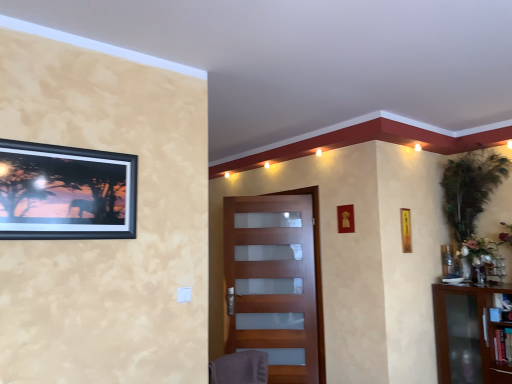
The image size is (512, 384). Describe the element at coordinates (67, 192) in the screenshot. I see `black matte picture frame at upper left, which ranks as the first picture frame in front-to-back order` at that location.

Where is `matte wood door at center`? This screenshot has height=384, width=512. matte wood door at center is located at coordinates (276, 282).

Does black matte picture frame at upper left, which ranks as the first picture frame in front-to-back order, appear on the right side of matte wood door at center?

In fact, black matte picture frame at upper left, which ranks as the first picture frame in front-to-back order, is to the left of matte wood door at center.

Can you tell me how much black matte picture frame at upper left, which ranks as the first picture frame in front-to-back order, and matte wood door at center differ in facing direction?

The angular difference between black matte picture frame at upper left, which ranks as the first picture frame in front-to-back order, and matte wood door at center is 26.3 degrees.

Does black matte picture frame at upper left, acting as the 2th picture frame starting from the back, lie in front of matte wood door at center?

Yes, it is in front of matte wood door at center.

You are a GUI agent. You are given a task and a screenshot of the screen. Output one action in this format:
    pyautogui.click(x=<x>, y=<y>)
    Task: Click on the door that appears below the black matte picture frame at upper left, which ranks as the first picture frame in front-to-back order (from a real-world perspective)
    This screenshot has height=384, width=512.
    Given the screenshot: What is the action you would take?
    pyautogui.click(x=276, y=282)

Is yellow paper at upper right, the second picture frame when ordered from top to bottom, spatially inside gray fabric swivel chair at lower center, or outside of it?

yellow paper at upper right, the second picture frame when ordered from top to bottom, is located beyond the bounds of gray fabric swivel chair at lower center.

In the scene shown: In terms of size, does yellow paper at upper right, the first picture frame viewed from the right, appear bigger or smaller than gray fabric swivel chair at lower center?

In the image, yellow paper at upper right, the first picture frame viewed from the right, appears to be smaller than gray fabric swivel chair at lower center.

Are black matte picture frame at upper left, acting as the 2th picture frame starting from the back, and transparent glass cabinet at right located far from each other?

Indeed, black matte picture frame at upper left, acting as the 2th picture frame starting from the back, is not near transparent glass cabinet at right.

From the image's perspective, who appears lower, black matte picture frame at upper left, acting as the 2th picture frame starting from the back, or transparent glass cabinet at right?

transparent glass cabinet at right.

You are a GUI agent. You are given a task and a screenshot of the screen. Output one action in this format:
    pyautogui.click(x=<x>, y=<y>)
    Task: Click on the 2nd picture frame above the transparent glass cabinet at right (from a real-world perspective)
    The image size is (512, 384).
    Given the screenshot: What is the action you would take?
    pyautogui.click(x=67, y=192)

From the image's perspective, which is above, matte wood door at center or black matte picture frame at upper left, which is counted as the second picture frame, starting from the right?

black matte picture frame at upper left, which is counted as the second picture frame, starting from the right.

How many degrees apart are the facing directions of matte wood door at center and black matte picture frame at upper left, placed as the 1th picture frame when sorted from top to bottom?

matte wood door at center and black matte picture frame at upper left, placed as the 1th picture frame when sorted from top to bottom, are facing 26.3 degrees away from each other.

Considering the relative sizes of matte wood door at center and black matte picture frame at upper left, which is counted as the second picture frame, starting from the right, in the image provided, is matte wood door at center bigger than black matte picture frame at upper left, which is counted as the second picture frame, starting from the right,?

Correct, matte wood door at center is larger in size than black matte picture frame at upper left, which is counted as the second picture frame, starting from the right.

Could you tell me if matte wood door at center is facing black matte picture frame at upper left, arranged as the first picture frame when viewed from the left?

No, matte wood door at center is not aimed at black matte picture frame at upper left, arranged as the first picture frame when viewed from the left.

Considering the positions of objects transparent glass cabinet at right and yellow paper at upper right, the second picture frame when ordered from top to bottom, in the image provided, who is in front, transparent glass cabinet at right or yellow paper at upper right, the second picture frame when ordered from top to bottom,?

transparent glass cabinet at right is in front.

From a real-world perspective, is transparent glass cabinet at right positioned above or below yellow paper at upper right, the first picture frame viewed from the right?

From a real-world perspective, transparent glass cabinet at right is physically below yellow paper at upper right, the first picture frame viewed from the right.

Considering the relative sizes of transparent glass cabinet at right and yellow paper at upper right, the 2th picture frame positioned from the left, in the image provided, is transparent glass cabinet at right bigger than yellow paper at upper right, the 2th picture frame positioned from the left,?

Yes.

Considering the relative sizes of transparent glass cabinet at right and yellow paper at upper right, the first picture frame viewed from the right, in the image provided, is transparent glass cabinet at right taller than yellow paper at upper right, the first picture frame viewed from the right,?

Indeed, transparent glass cabinet at right has a greater height compared to yellow paper at upper right, the first picture frame viewed from the right.

From a real-world perspective, count 2nd picture frames upward from the transparent glass cabinet at right and point to it. Please provide its 2D coordinates.

[(67, 192)]

Which object is positioned more to the right, transparent glass cabinet at right or black matte picture frame at upper left, which is counted as the second picture frame, starting from the right?

From the viewer's perspective, transparent glass cabinet at right appears more on the right side.

Who is shorter, transparent glass cabinet at right or black matte picture frame at upper left, which ranks as the first picture frame in front-to-back order?

With less height is black matte picture frame at upper left, which ranks as the first picture frame in front-to-back order.

From the image's perspective, between transparent glass cabinet at right and black matte picture frame at upper left, placed as the 1th picture frame when sorted from top to bottom, who is located below?

transparent glass cabinet at right, from the image's perspective.

From a real-world perspective, which object rests below the other?

transparent glass cabinet at right, from a real-world perspective.

Is transparent glass cabinet at right smaller than gray fabric swivel chair at lower center?

No, transparent glass cabinet at right is not smaller than gray fabric swivel chair at lower center.

Is transparent glass cabinet at right oriented towards gray fabric swivel chair at lower center?

Yes, transparent glass cabinet at right is aimed at gray fabric swivel chair at lower center.

Which point is more distant from viewer, (441, 333) or (259, 361)?

The point (441, 333) is farther.

This screenshot has height=384, width=512. Find the location of `picture frame on the left of matte wood door at center`. picture frame on the left of matte wood door at center is located at coordinates (67, 192).

Identify the location of picture frame that is the 1st object above the gray fabric swivel chair at lower center (from a real-world perspective). (406, 230).

Estimate the real-world distances between objects in this image. Which object is closer to gray fabric swivel chair at lower center, yellow paper at upper right, the second picture frame when ordered from top to bottom, or matte wood door at center?

matte wood door at center is positioned closer to the anchor gray fabric swivel chair at lower center.

Based on their spatial positions, is yellow paper at upper right, the 2th picture frame positioned from the left, or matte wood door at center closer to black matte picture frame at upper left, which ranks as the first picture frame in front-to-back order?

Based on the image, matte wood door at center appears to be nearer to black matte picture frame at upper left, which ranks as the first picture frame in front-to-back order.

Looking at the image, which one is located closer to yellow paper at upper right, the second picture frame when ordered from top to bottom, gray fabric swivel chair at lower center or green leafy plant at upper right?

green leafy plant at upper right.

When comparing their distances from black matte picture frame at upper left, arranged as the first picture frame when viewed from the left, does green leafy plant at upper right or matte wood door at center seem closer?

The object closer to black matte picture frame at upper left, arranged as the first picture frame when viewed from the left, is matte wood door at center.

Considering their positions, is yellow paper at upper right, the first picture frame viewed from the right, positioned closer to gray fabric swivel chair at lower center than green leafy plant at upper right?

yellow paper at upper right, the first picture frame viewed from the right, lies closer to gray fabric swivel chair at lower center than the other object.

Estimate the real-world distances between objects in this image. Which object is closer to transparent glass cabinet at right, gray fabric swivel chair at lower center or black matte picture frame at upper left, acting as the 2th picture frame starting from the back?

Among the two, gray fabric swivel chair at lower center is located nearer to transparent glass cabinet at right.

Consider the image. Which object lies nearer to the anchor point transparent glass cabinet at right, yellow paper at upper right, placed as the second picture frame when sorted from front to back, or gray fabric swivel chair at lower center?

yellow paper at upper right, placed as the second picture frame when sorted from front to back.

When comparing their distances from yellow paper at upper right, which is the 1th picture frame from back to front, does black matte picture frame at upper left, positioned as the 2th picture frame in bottom-to-top order, or gray fabric swivel chair at lower center seem closer?

gray fabric swivel chair at lower center lies closer to yellow paper at upper right, which is the 1th picture frame from back to front, than the other object.

Identify the location of door between gray fabric swivel chair at lower center and yellow paper at upper right, the first picture frame in the bottom-to-top sequence, from left to right. This screenshot has width=512, height=384. (276, 282).

What are the coordinates of `picture frame between matte wood door at center and transparent glass cabinet at right from left to right` in the screenshot? It's located at (406, 230).

Image resolution: width=512 pixels, height=384 pixels. Identify the location of door situated between gray fabric swivel chair at lower center and green leafy plant at upper right from left to right. (276, 282).

Find the location of a particular element. swivel chair between black matte picture frame at upper left, positioned as the 2th picture frame in bottom-to-top order, and matte wood door at center from front to back is located at coordinates (240, 368).